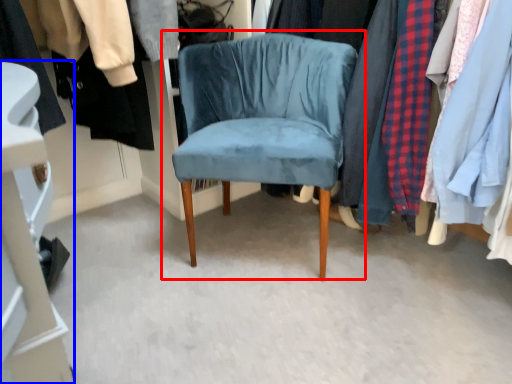
Question: Which of the following is the closest to the observer, chair (highlighted by a red box) or closet (highlighted by a blue box)?

Choices:
 (A) chair
 (B) closet

Answer: (A)